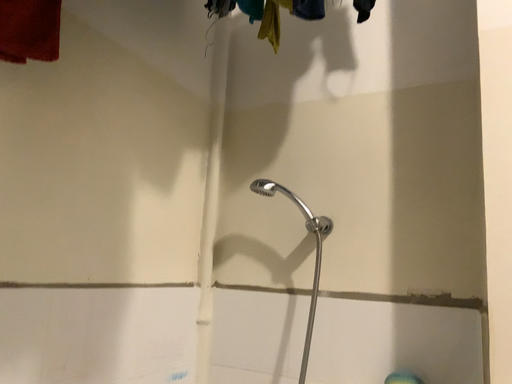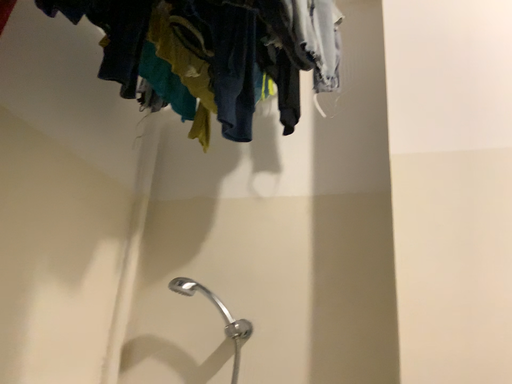
Question: How did the camera likely rotate when shooting the video?

Choices:
 (A) rotated downward
 (B) rotated upward

Answer: (B)